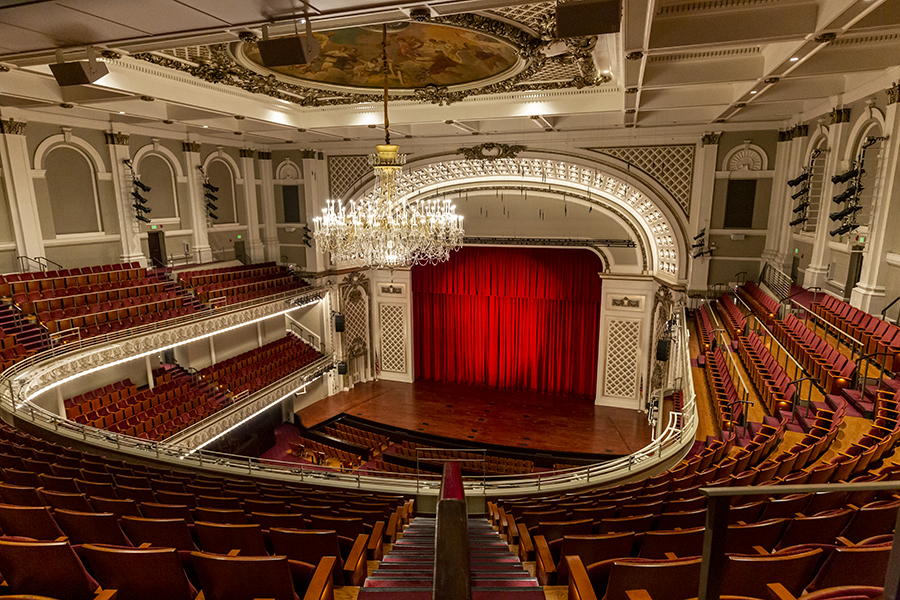
Identify the location of chandeliers. (392, 217).